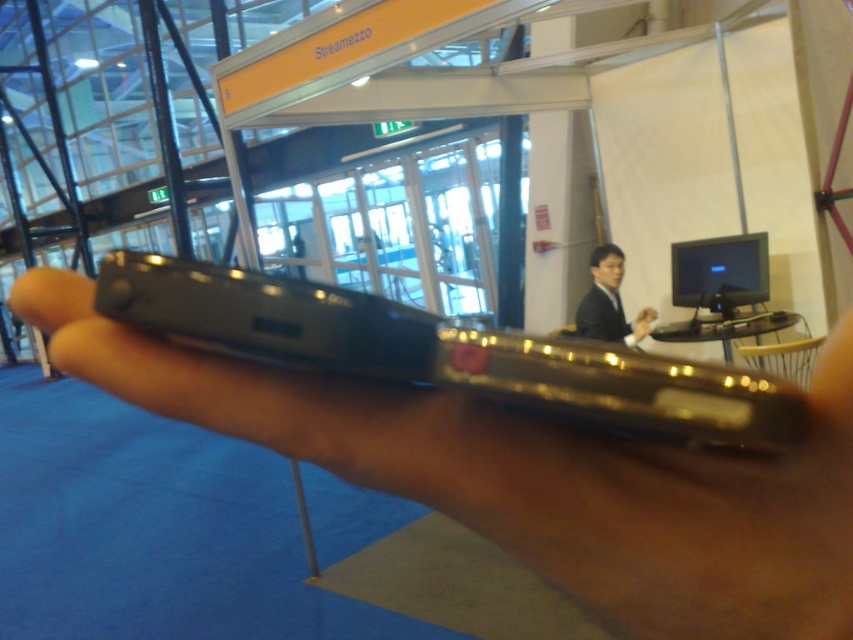
Can you confirm if black matte phone at center is bigger than black suit at center?

Actually, black matte phone at center might be smaller than black suit at center.

Between point (421, 413) and point (606, 268), which one is positioned behind?

Point (606, 268)

Locate an element on the screen. black matte phone at center is located at coordinates (531, 477).